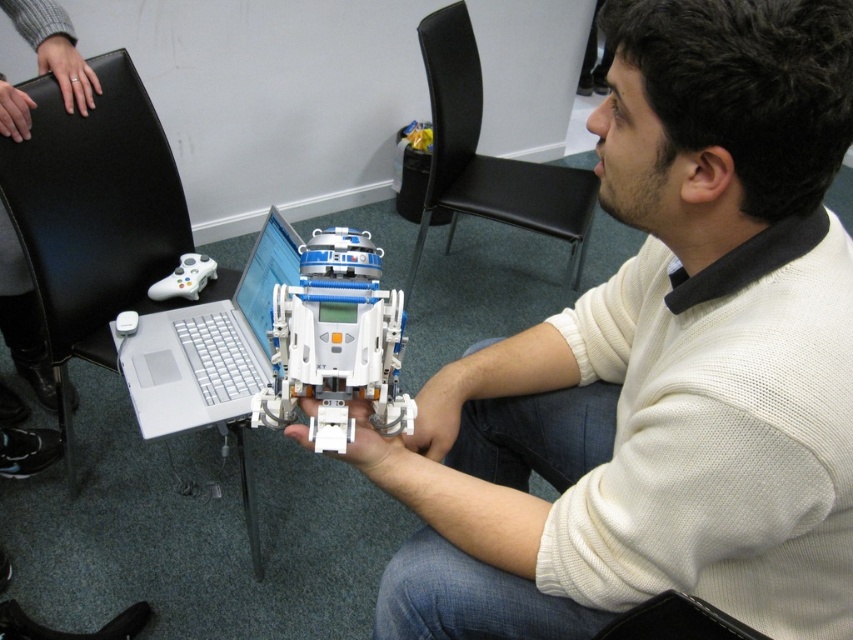
You are sitting in the black leather chair at left and want to reach the silver metallic laptop at center to grab a USB drive. Can you comfortably reach it without getting up?

The black leather chair at left is further to the viewer than the silver metallic laptop at center, meaning the laptop is closer to you. Since the laptop is closer, you can comfortably reach it without getting up.

You are a delivery person who needs to place a small package between the white matte robot at center and the black fabric chair at lower right. The package is 10 inches long. Can you fit it between them without moving either object?

The white matte robot at center is 9.83 inches from the black fabric chair at lower right. Since the package is 10 inches long, it cannot fit between them as the distance is slightly less than the package length.

You are sitting on the black leather chair at left and want to pick up the white matte robot at center. Can you reach it without moving your chair?

The white matte robot at center is below the black leather chair at left, so it is likely within arm reach. You can probably pick it up without moving your chair.